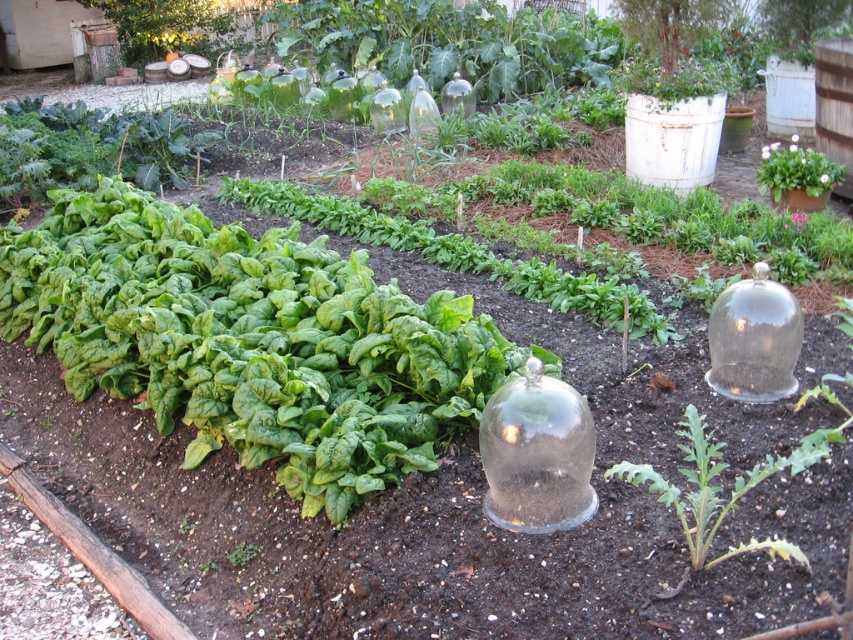
Question: Can you confirm if green leafy at lower right is positioned above white matte flower pot at upper right?

Choices:
 (A) yes
 (B) no

Answer: (B)

Question: Which is nearer to the green leafy spinach at left?

Choices:
 (A) white matte flower pot at upper right
 (B) green leafy at lower right

Answer: (B)

Question: Which is nearer to the green leafy at lower right?

Choices:
 (A) white matte flower pot at upper right
 (B) green leafy spinach at left

Answer: (B)

Question: Is green leafy spinach at left thinner than green leafy at lower right?

Choices:
 (A) yes
 (B) no

Answer: (B)

Question: Which object is positioned farthest from the green leafy at lower right?

Choices:
 (A) green leafy spinach at left
 (B) white matte flower pot at upper right

Answer: (B)

Question: Does green leafy spinach at left come behind white matte flower pot at upper right?

Choices:
 (A) no
 (B) yes

Answer: (A)